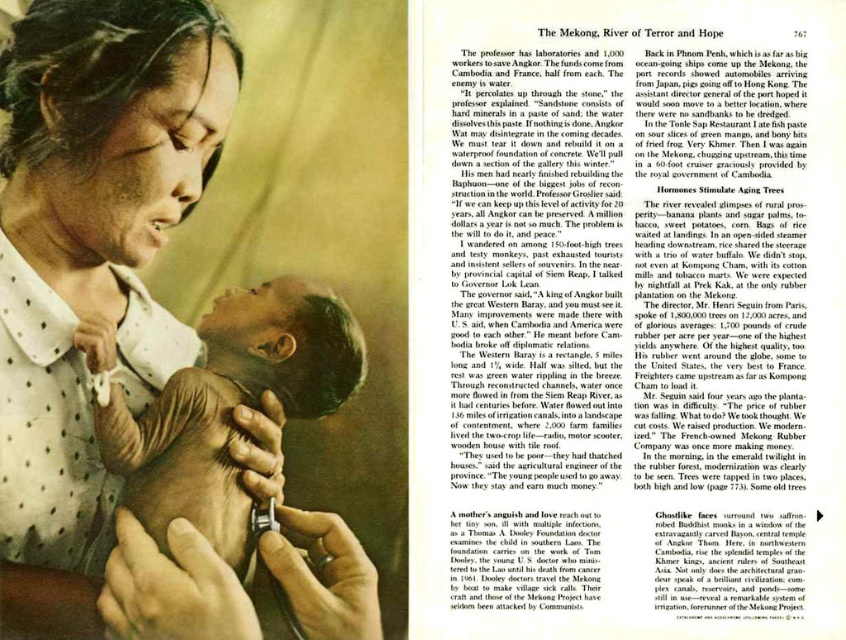
Which is in front, point (86, 88) or point (166, 480)?

Point (86, 88) is more forward.

Which is below, matte white blouse at center or light brown skin baby at center?

light brown skin baby at center

The height and width of the screenshot is (640, 846). What do you see at coordinates (89, 260) in the screenshot?
I see `matte white blouse at center` at bounding box center [89, 260].

Identify the location of matte white blouse at center. (89, 260).